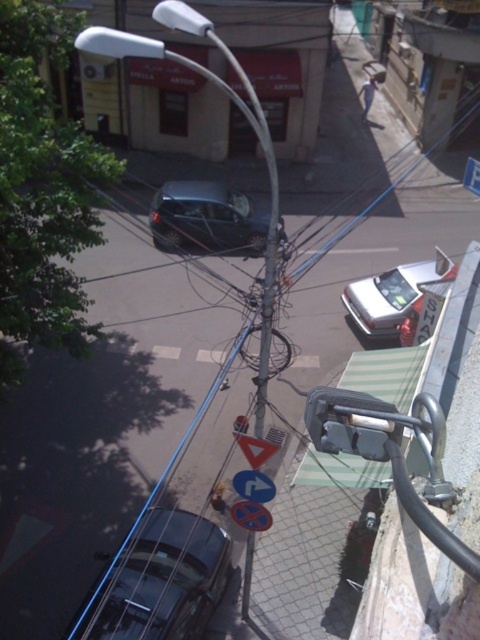
You are standing at the corner of the street and want to locate the shiny dark gray car at center. According to the coordinates given, where would you find it?

The shiny dark gray car at center is located at coordinates point (x=206, y=218).

You are standing at the point with coordinates point [232,102] in the urban street scene. What object are you standing on?

You are standing on the white glossy lamp post at center.

You are standing on a balcony overlooking the street. You see a shiny dark gray car at center and a white plastic sign at upper right. Which object is closer to the ground?

The shiny dark gray car at center is closer to the ground than the white plastic sign at upper right.